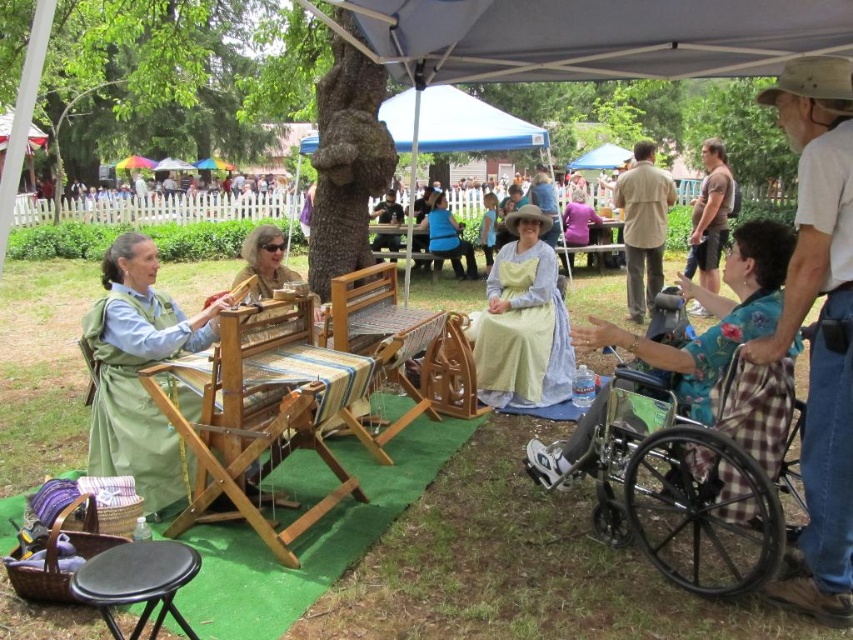
Question: Which point is closer to the camera?

Choices:
 (A) black plastic wheelchair at lower right
 (B) matte brown hair at center

Answer: (A)

Question: Can you confirm if black plastic wheelchair at lower right is thinner than brown cotton shirt at upper right?

Choices:
 (A) yes
 (B) no

Answer: (B)

Question: Does black plastic wheelchair at lower right appear under matte brown hair at center?

Choices:
 (A) yes
 (B) no

Answer: (A)

Question: Which object appears farthest from the camera in this image?

Choices:
 (A) brown cotton shirt at upper right
 (B) matte brown hair at center

Answer: (A)

Question: Is black plastic wheelchair at lower right thinner than brown cotton shirt at upper right?

Choices:
 (A) yes
 (B) no

Answer: (B)

Question: Estimate the real-world distances between objects in this image. Which object is closer to the green cotton apron at left?

Choices:
 (A) light blue fabric at center
 (B) light blue cotton dress at center

Answer: (B)